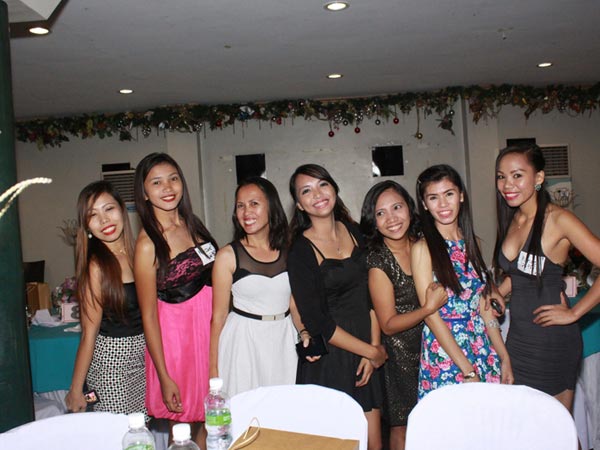
Where is `white painted walls`? The height and width of the screenshot is (450, 600). white painted walls is located at coordinates (82, 156), (315, 141), (550, 124).